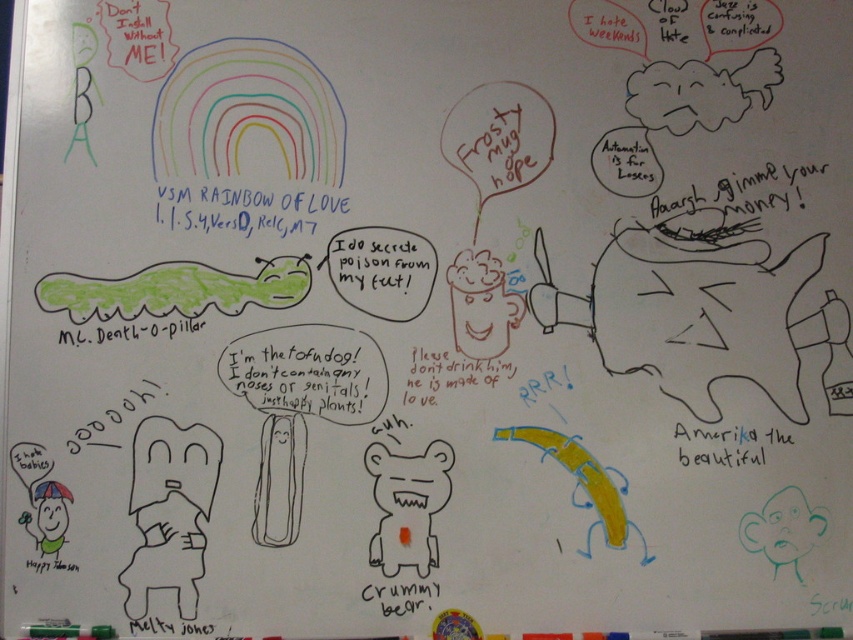
You are a student who wants to write a note on the whiteboard. You see the black marker text at upper center and the black paper at lower right. Which object is taller?

The black marker text at upper center is much taller than the black paper at lower right.

You are a student who wants to write a note on the whiteboard. The black marker text at upper center and the black paper at lower right are both in your view. Which object would you choose to write on if you want your note to be more visible to others?

The black marker text at upper center has a larger size compared to the black paper at lower right, so writing on the black marker text at upper center would make the note more visible.